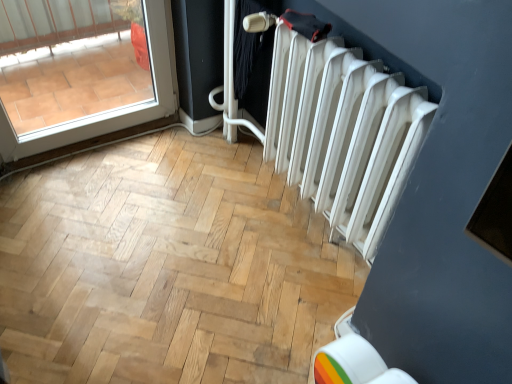
At what (x,y) coordinates should I click in order to perform the action: click on free point below transparent glass door at upper left (from a real-world perspective). Please return your answer as a coordinate pair (x, y). This screenshot has height=384, width=512. Looking at the image, I should click on (97, 144).